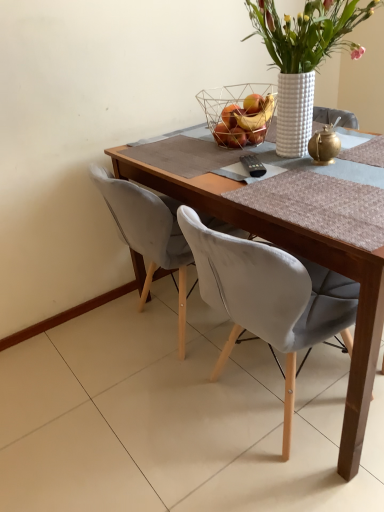
What are the coordinates of `free space above wooden table at center (from a real-world perspective)` in the screenshot? It's located at (256, 162).